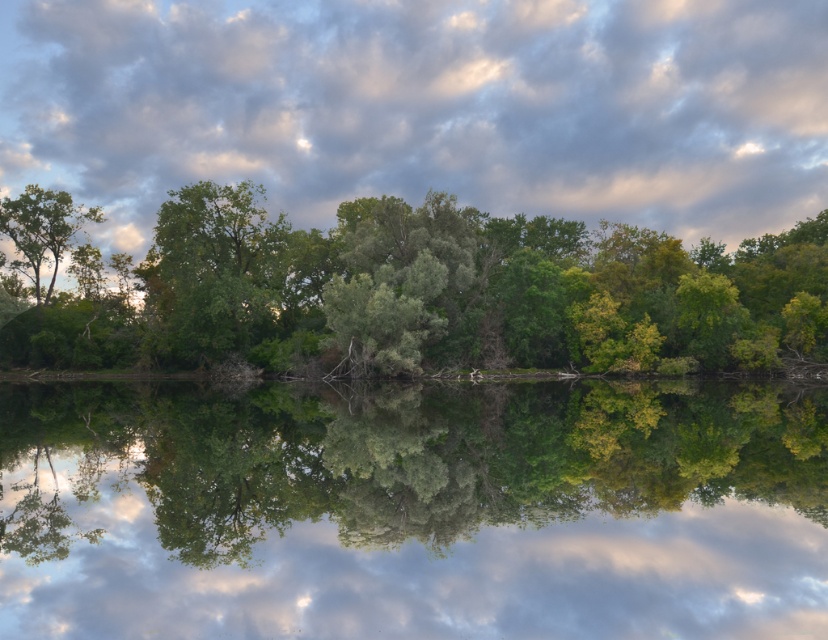
Question: Which of these objects is positioned farthest from the green leafy tree at center?

Choices:
 (A) green leafy trees at center
 (B) green leafy river at center
 (C) cloudy sky at upper center
 (D) green matte tree at left

Answer: (C)

Question: Considering the relative positions of green leafy tree at center and green matte tree at left in the image provided, where is green leafy tree at center located with respect to green matte tree at left?

Choices:
 (A) below
 (B) above

Answer: (A)

Question: Which point appears farthest from the camera in this image?

Choices:
 (A) (398, 77)
 (B) (222, 189)
 (C) (32, 236)

Answer: (A)

Question: Estimate the real-world distances between objects in this image. Which object is farther from the green leafy trees at center?

Choices:
 (A) cloudy sky at upper center
 (B) green leafy tree at center
 (C) green leafy river at center

Answer: (A)

Question: Is green leafy river at center above cloudy sky at upper center?

Choices:
 (A) yes
 (B) no

Answer: (B)

Question: Does cloudy sky at upper center have a larger size compared to green leafy tree at center?

Choices:
 (A) no
 (B) yes

Answer: (B)